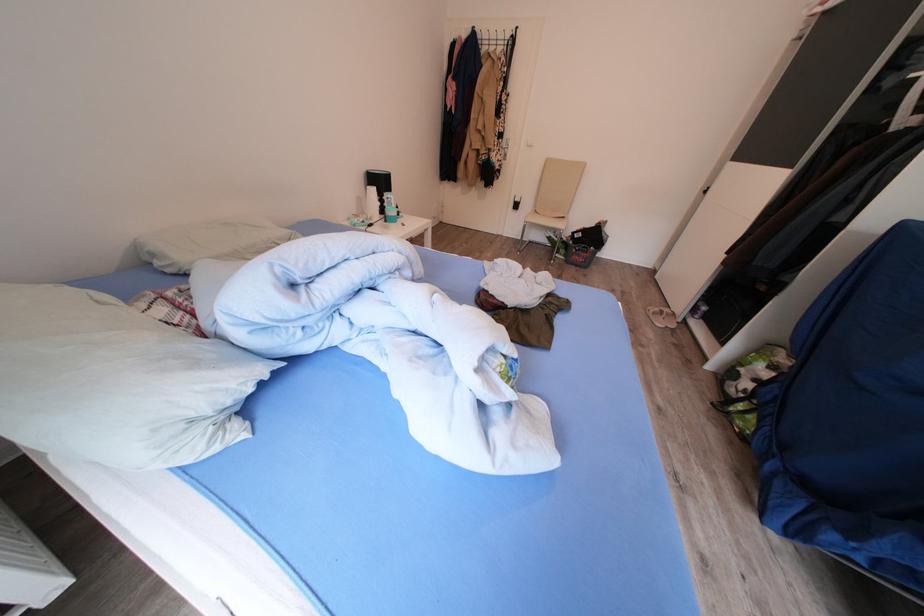
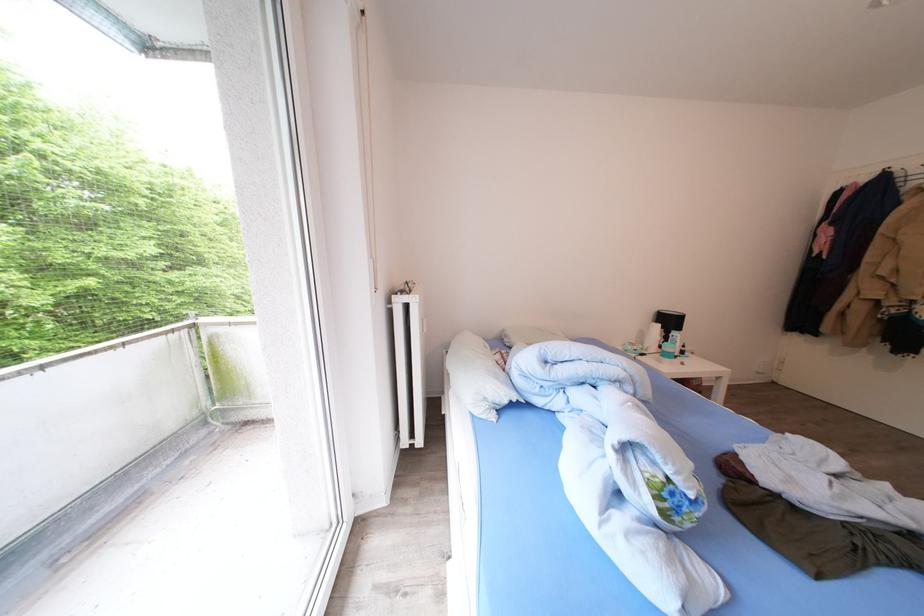
Find the pixel in the second image that matches [388,188] in the first image.

(677, 326)